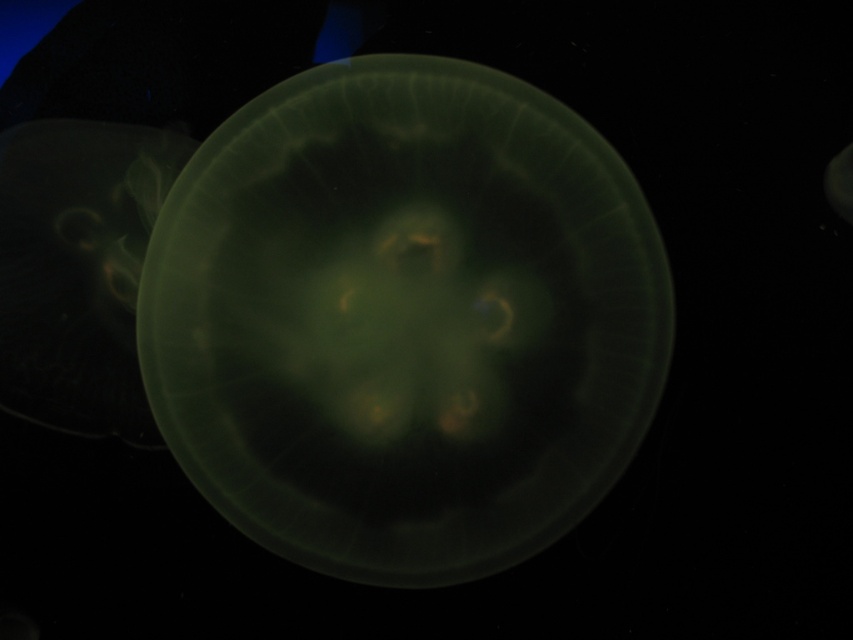
Between translucent green jellyfish at center and translucent green jellyfish at left, which one is positioned higher?

translucent green jellyfish at left is above.

Between point (399, 340) and point (144, 228), which one is positioned in front?

Point (144, 228)

Find the location of a particular element. translucent green jellyfish at center is located at coordinates (x=404, y=320).